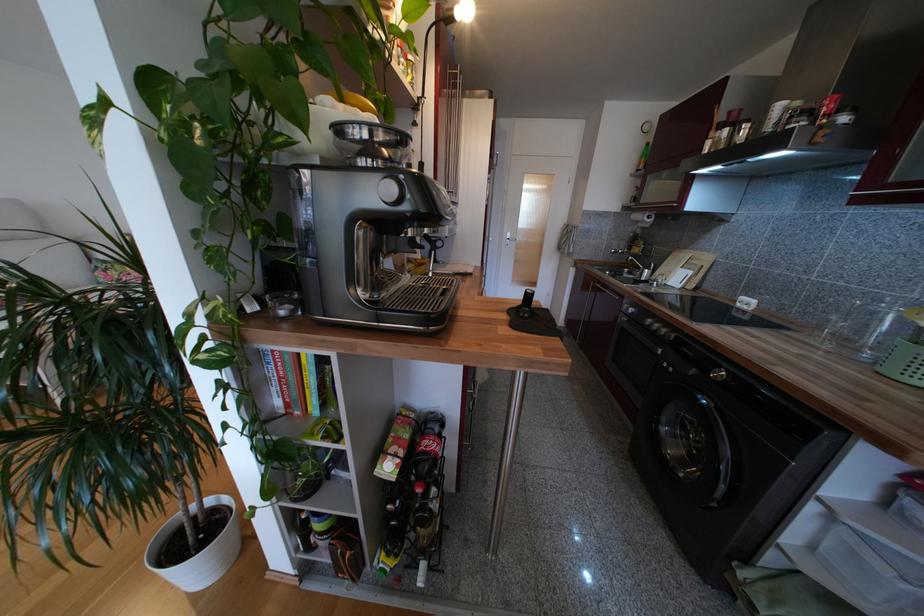
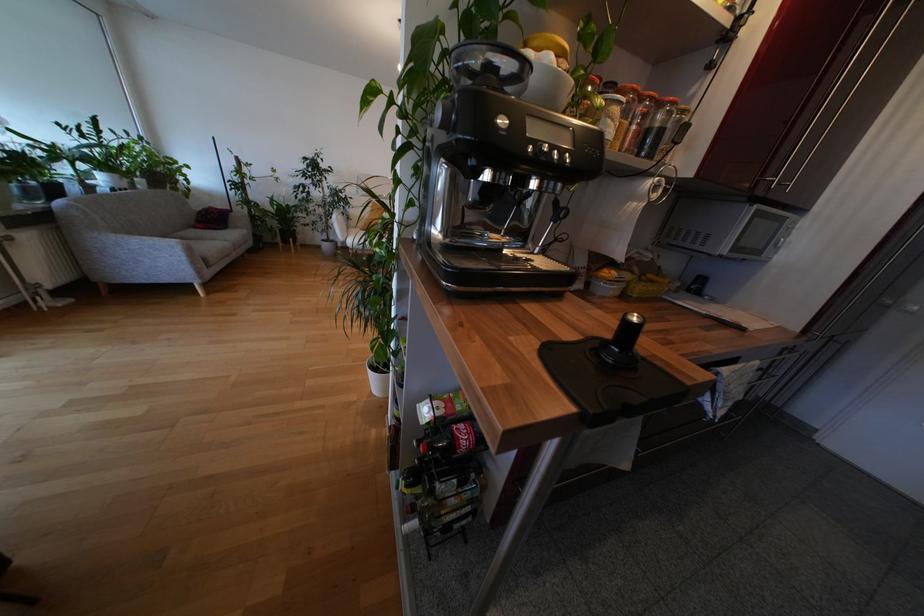
Where in the second image is the point corresponding to (x=290, y=139) from the first image?

(450, 95)